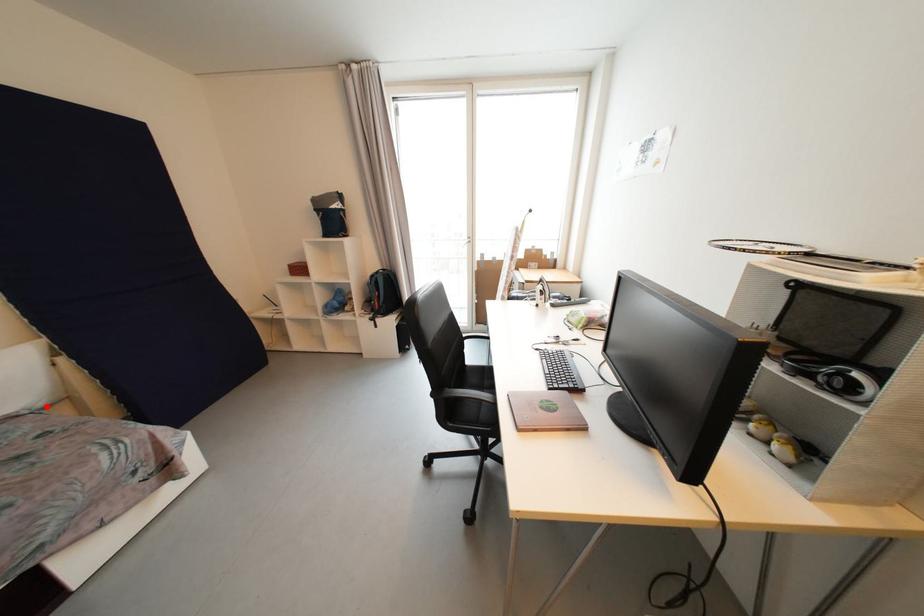
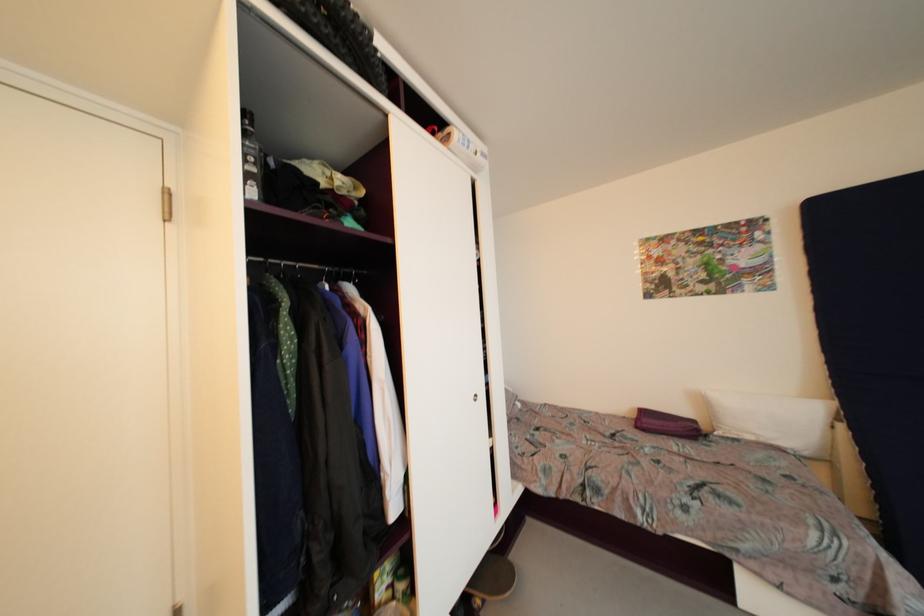
The point at the highlighted location is marked in the first image. Where is the corresponding point in the second image?

(810, 456)